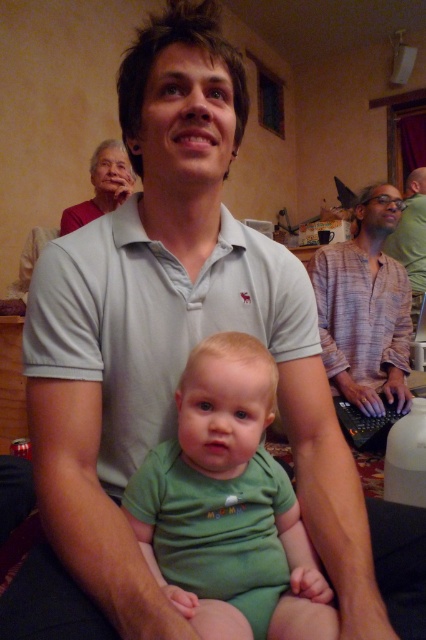
You are standing in the scene and want to hand a gift to the person wearing the light gray cotton polo shirt at center and the person wearing the plaid shirt at center. Which one should you approach first based on their positions?

You should approach the light gray cotton polo shirt at center first because it is closer to the viewer than the plaid shirt at center.

You are a photographer trying to capture a clear shot of the baby in the green cotton onesie at center. Since the light gray cotton polo shirt at center is blocking part of the baby, can you adjust your position to get an unobstructed view?

The light gray cotton polo shirt at center is positioned over the green cotton onesie at center, so adjusting your position to the side or slightly behind the baby might help you get an unobstructed view.